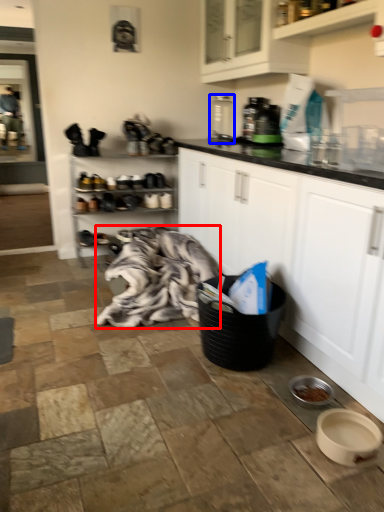
Question: Among these objects, which one is farthest to the camera, blanket (highlighted by a red box) or appliance (highlighted by a blue box)?

Choices:
 (A) blanket
 (B) appliance

Answer: (B)